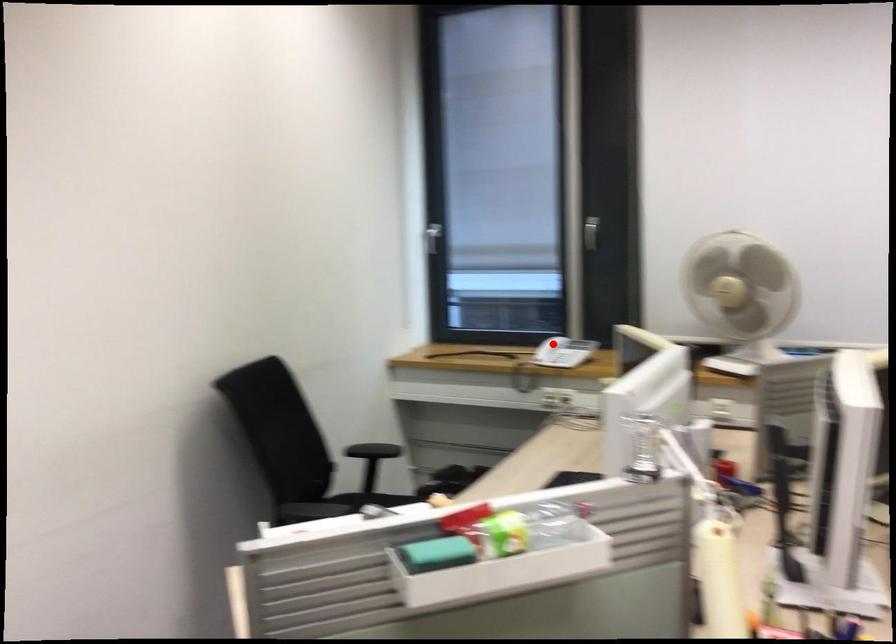
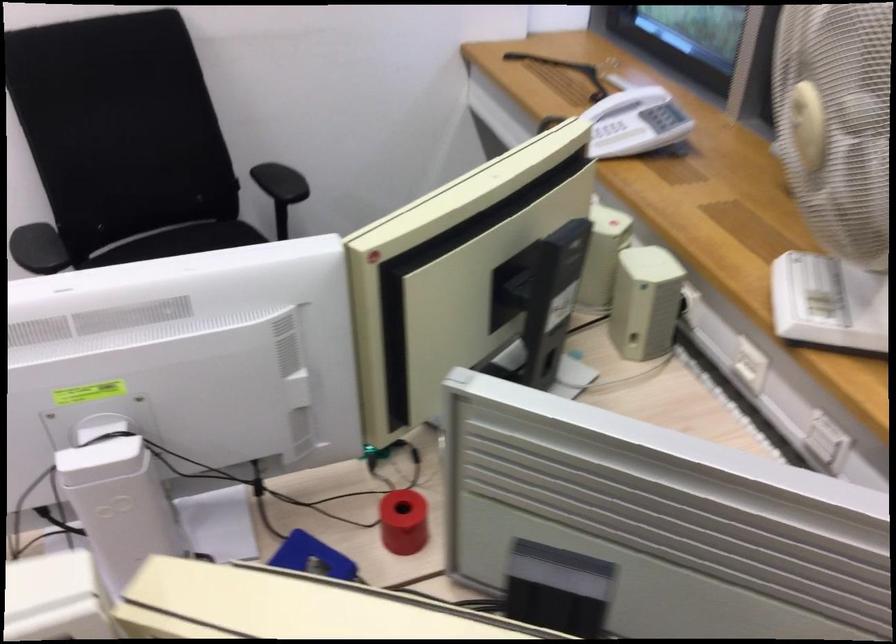
Question: I am providing you with two images of the same scene from different viewpoints. A red point is shown in image1. For the corresponding object point in image2, is it positioned nearer or farther from the camera?

Choices:
 (A) Nearer
 (B) Farther

Answer: (A)